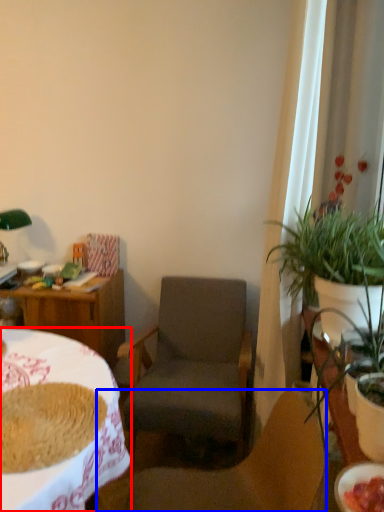
Question: Among these objects, which one is farthest to the camera, desk (highlighted by a red box) or chair (highlighted by a blue box)?

Choices:
 (A) desk
 (B) chair

Answer: (B)